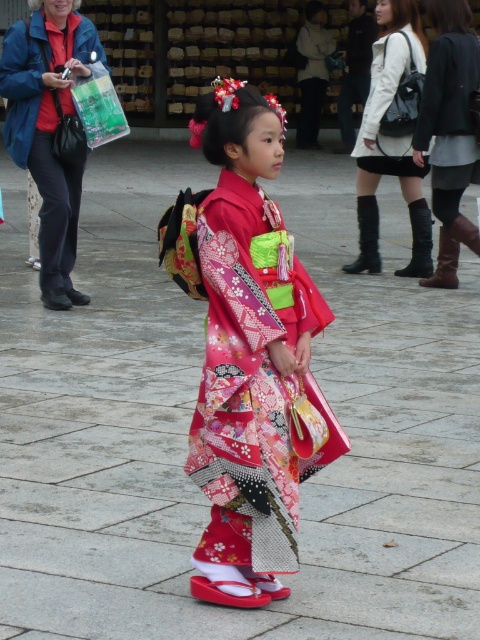
You are a fashion designer observing the girl in the image. You notice both the white leather jacket at upper center and the white leather dress at upper center. Which clothing item is closer to you?

The white leather jacket at upper center is closer to you because it is positioned further to the viewer than the white leather dress at upper center.

You are looking at the image of a girl in traditional Japanese attire. There are two jackets in the upper part of the image. Which one is positioned lower between the matte blue jacket at upper left and the white leather jacket at upper center?

The matte blue jacket at upper left is positioned lower than the white leather jacket at upper center.

You are a fashion designer observing the image. You need to determine which clothing item is more suitable for a formal event. Based on the description of the silky kimono at center and the white leather dress at upper center, which one would you recommend?

The silky kimono at center is larger in size compared to the white leather dress at upper center, so it might be more appropriate for a formal event as it commands more attention and presence.